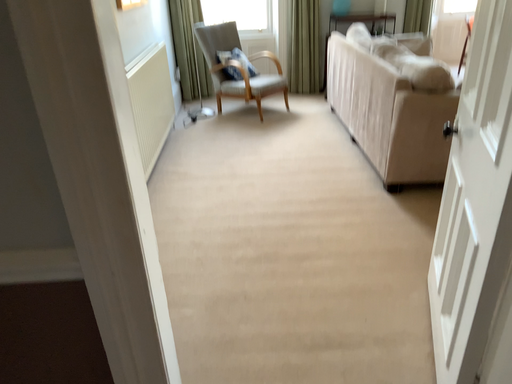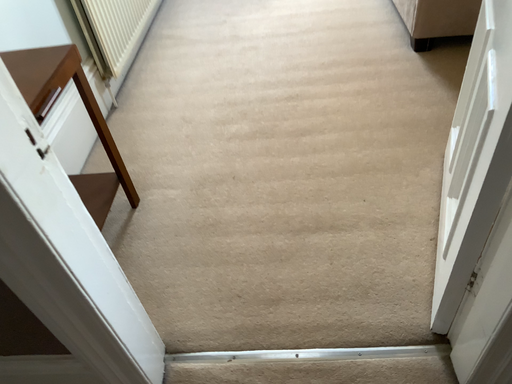
Question: Which way did the camera rotate in the video?

Choices:
 (A) rotated upward
 (B) rotated downward

Answer: (B)